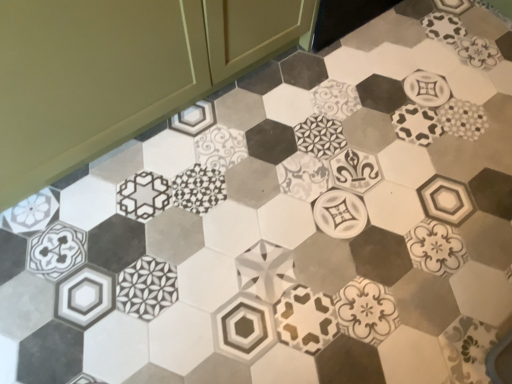
What do you see at coordinates (118, 72) in the screenshot?
I see `matte green cabinet at upper left` at bounding box center [118, 72].

Where is `matte green cabinet at upper left`? This screenshot has height=384, width=512. matte green cabinet at upper left is located at coordinates coord(118,72).

Where is `matte green cabinet at upper left`? The height and width of the screenshot is (384, 512). matte green cabinet at upper left is located at coordinates (118, 72).